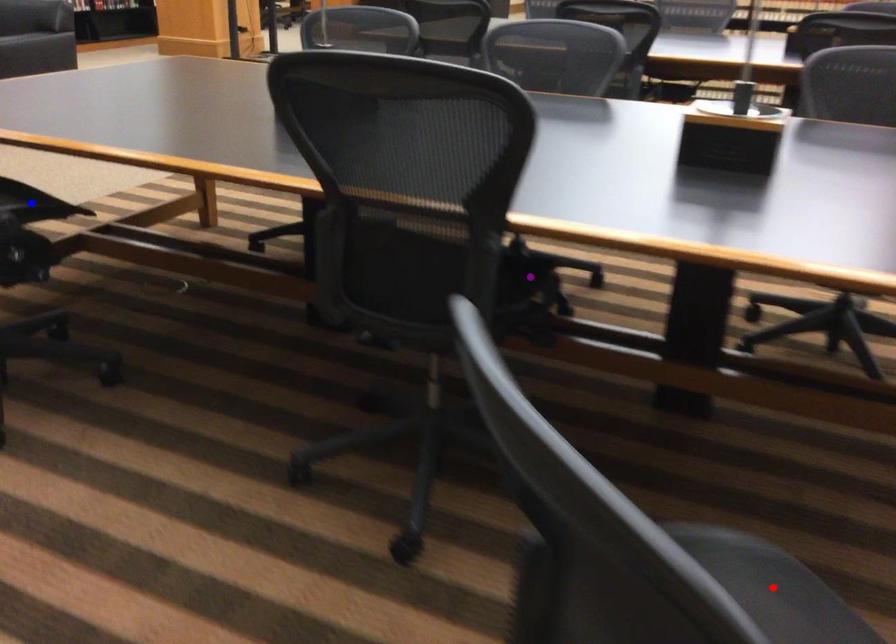
Order these from nearest to farthest:
blue point | red point | purple point

blue point, purple point, red point